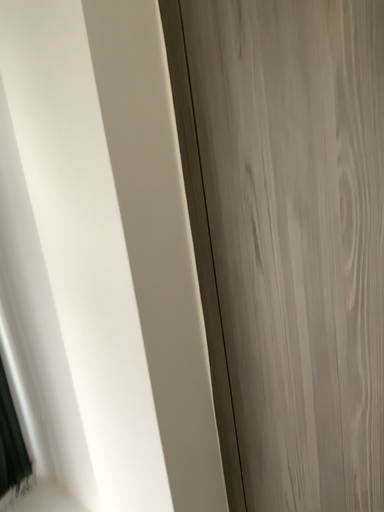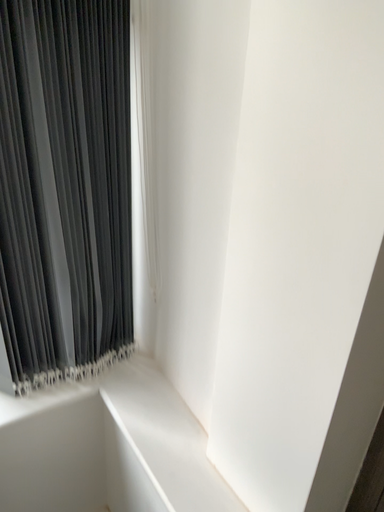
Question: How did the camera likely rotate when shooting the video?

Choices:
 (A) rotated downward
 (B) rotated upward

Answer: (A)